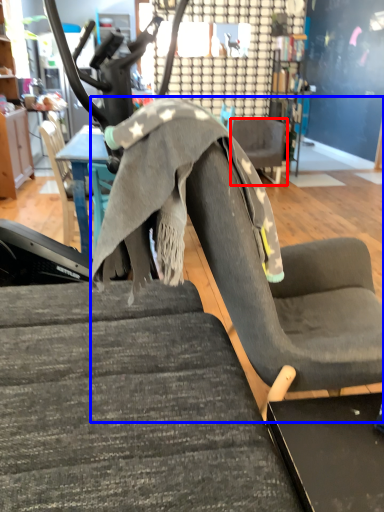
Question: Which of the following is the farthest to the observer, chair (highlighted by a red box) or swivel chair (highlighted by a blue box)?

Choices:
 (A) chair
 (B) swivel chair

Answer: (A)